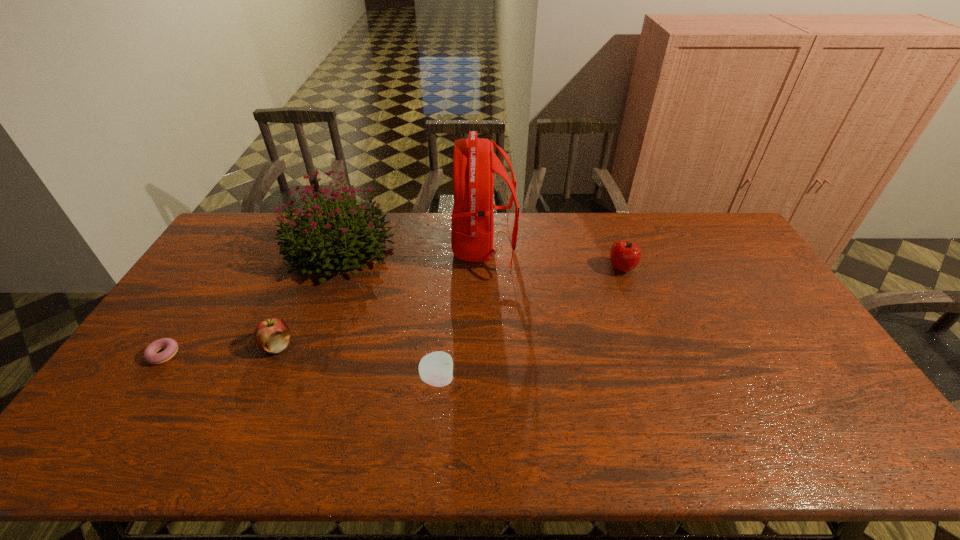
Identify the location of empty location between the tallest object and the farthest apple. (553, 258).

Locate an element on the screen. The image size is (960, 540). vacant space that's between the leftmost object and the rightmost apple is located at coordinates pyautogui.click(x=393, y=312).

Select which object appears as the closest to the tallest object. Please provide its 2D coordinates. Your answer should be formatted as a tuple, i.e. [(x, y)], where the tuple contains the x and y coordinates of a point satisfying the conditions above.

[(309, 244)]

Locate an element on the screen. Image resolution: width=960 pixels, height=540 pixels. the fifth closest object to the doughnut is located at coordinates (624, 256).

Identify which apple is the third nearest to the backpack. Please provide its 2D coordinates. Your answer should be formatted as a tuple, i.e. [(x, y)], where the tuple contains the x and y coordinates of a point satisfying the conditions above.

[(272, 335)]

Select which apple appears as the second closest to the bouquet. Please provide its 2D coordinates. Your answer should be formatted as a tuple, i.e. [(x, y)], where the tuple contains the x and y coordinates of a point satisfying the conditions above.

[(436, 368)]

Where is `vacant space that satisfies the following two spatial constraints: 1. on the front side of the second apple from left to right; 2. on the left side of the leftmost apple`? vacant space that satisfies the following two spatial constraints: 1. on the front side of the second apple from left to right; 2. on the left side of the leftmost apple is located at coordinates (263, 379).

What are the coordinates of `free region that satisfies the following two spatial constraints: 1. on the main compartment of the tallest object; 2. on the front side of the leftmost object` in the screenshot? It's located at (485, 354).

The width and height of the screenshot is (960, 540). Identify the location of free space that satisfies the following two spatial constraints: 1. on the main compartment of the backpack; 2. on the front side of the leftmost apple. (485, 346).

Image resolution: width=960 pixels, height=540 pixels. Find the location of `vacant area in the image that satisfies the following two spatial constraints: 1. on the back side of the third tallest object; 2. on the right side of the second apple from right to left`. vacant area in the image that satisfies the following two spatial constraints: 1. on the back side of the third tallest object; 2. on the right side of the second apple from right to left is located at coordinates (447, 268).